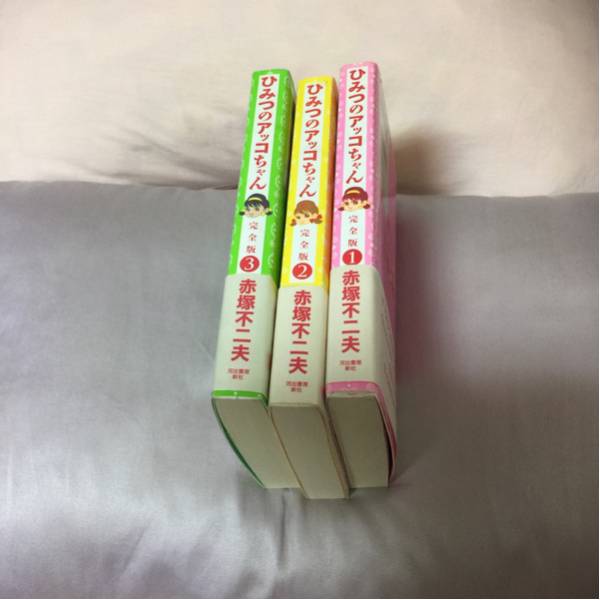
Where is `bed sheets behind pillow`? Image resolution: width=600 pixels, height=600 pixels. bed sheets behind pillow is located at coordinates (155, 81).